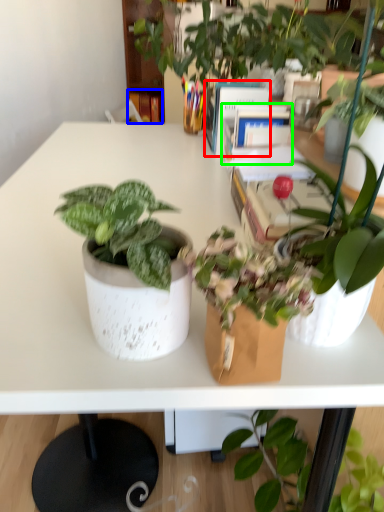
Question: Considering the real-world distances, which object is farthest from book (highlighted by a red box)? book (highlighted by a blue box) or book (highlighted by a green box)?

Choices:
 (A) book
 (B) book

Answer: (A)